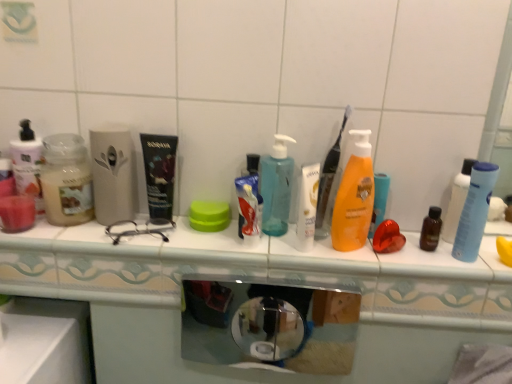
Find the location of a particular element. This screenshot has height=384, width=512. vacant space in front of matte glass jar at left, acting as the third bottle starting from the right is located at coordinates (58, 239).